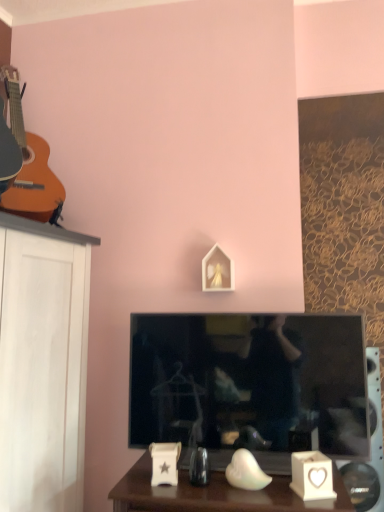
Question: From the image's perspective, would you say white ceramic heart-shaped candle holder at lower right is shown under black glossy television at center?

Choices:
 (A) yes
 (B) no

Answer: (A)

Question: Is white ceramic heart-shaped candle holder at lower right wider than black glossy television at center?

Choices:
 (A) yes
 (B) no

Answer: (B)

Question: Does white ceramic heart-shaped candle holder at lower right have a lesser width compared to black glossy television at center?

Choices:
 (A) yes
 (B) no

Answer: (A)

Question: Is white ceramic heart-shaped candle holder at lower right aimed at black glossy television at center?

Choices:
 (A) no
 (B) yes

Answer: (A)

Question: From a real-world perspective, does white ceramic heart-shaped candle holder at lower right sit lower than black glossy television at center?

Choices:
 (A) yes
 (B) no

Answer: (A)

Question: Could black glossy television at center be considered to be inside white ceramic heart-shaped candle holder at lower right?

Choices:
 (A) yes
 (B) no

Answer: (B)

Question: Is the surface of white matte picture frame at center in direct contact with white ceramic heart-shaped candle holder at lower right?

Choices:
 (A) no
 (B) yes

Answer: (A)

Question: Is white matte picture frame at center shorter than white ceramic heart-shaped candle holder at lower right?

Choices:
 (A) no
 (B) yes

Answer: (A)

Question: Can you confirm if white matte picture frame at center is thinner than white ceramic heart-shaped candle holder at lower right?

Choices:
 (A) no
 (B) yes

Answer: (B)

Question: Considering the relative sizes of white matte picture frame at center and white ceramic heart-shaped candle holder at lower right in the image provided, is white matte picture frame at center bigger than white ceramic heart-shaped candle holder at lower right?

Choices:
 (A) no
 (B) yes

Answer: (B)

Question: Considering the relative positions of white matte picture frame at center and white ceramic heart-shaped candle holder at lower right in the image provided, is white matte picture frame at center behind white ceramic heart-shaped candle holder at lower right?

Choices:
 (A) no
 (B) yes

Answer: (B)

Question: Is white matte picture frame at center surrounding white ceramic heart-shaped candle holder at lower right?

Choices:
 (A) no
 (B) yes

Answer: (A)

Question: Does white matte picture frame at center appear on the left side of black glossy television at center?

Choices:
 (A) no
 (B) yes

Answer: (B)